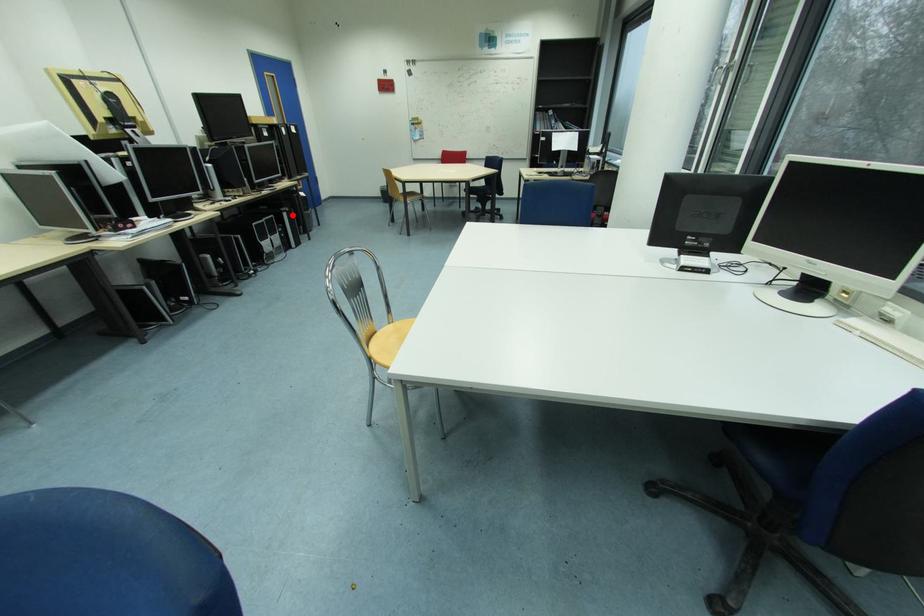
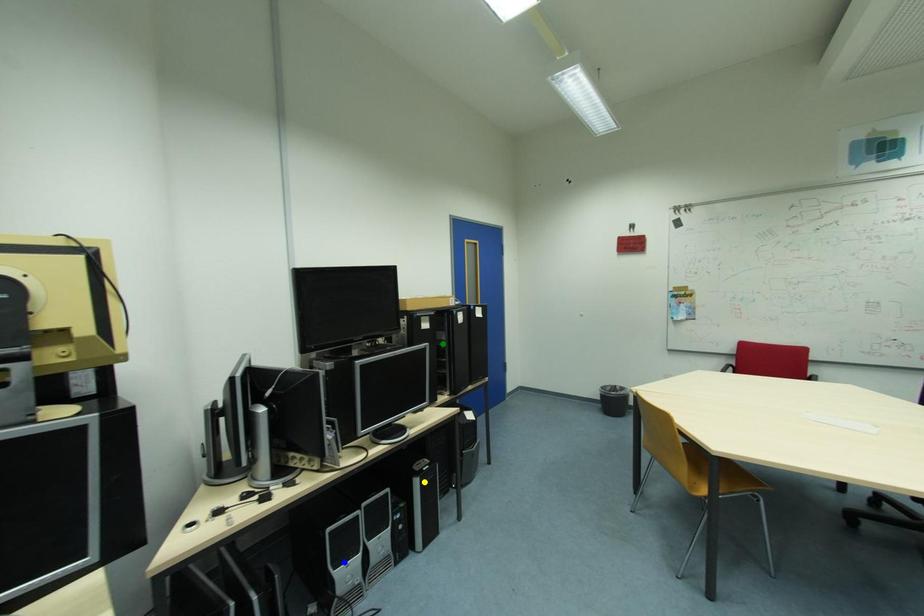
Question: I am providing you with two images of the same scene from different viewpoints. A red point is marked on the first image. You are given multiple points on the second image. Can you choose the point in image 2 that corresponds to the point in image 1?

Choices:
 (A) blue point
 (B) green point
 (C) yellow point

Answer: (C)